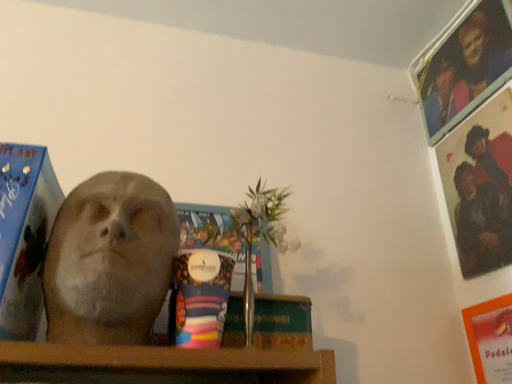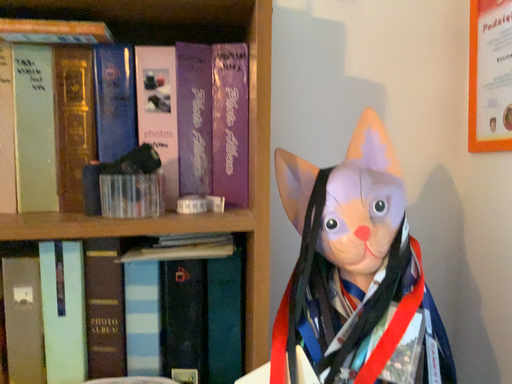
Question: How did the camera likely rotate when shooting the video?

Choices:
 (A) rotated downward
 (B) rotated upward

Answer: (A)